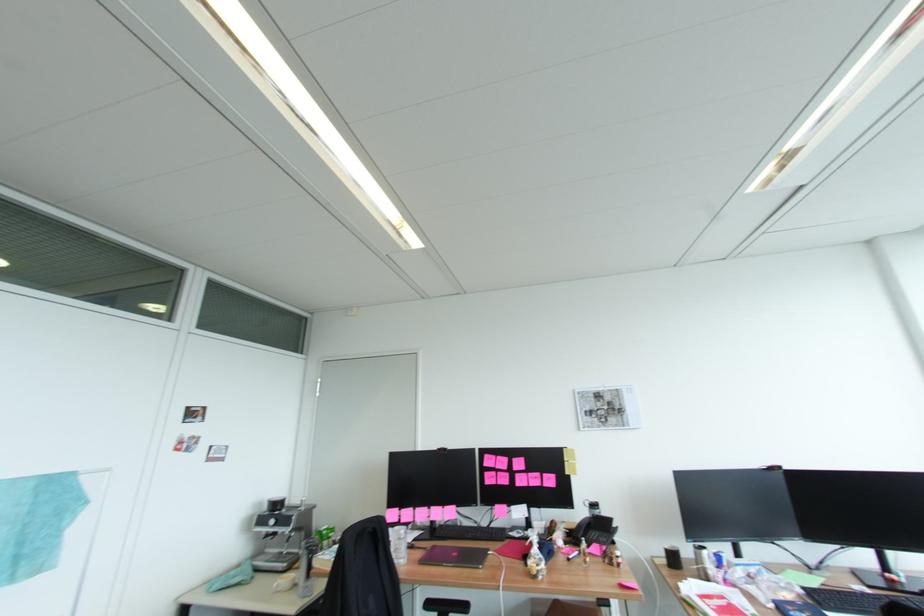
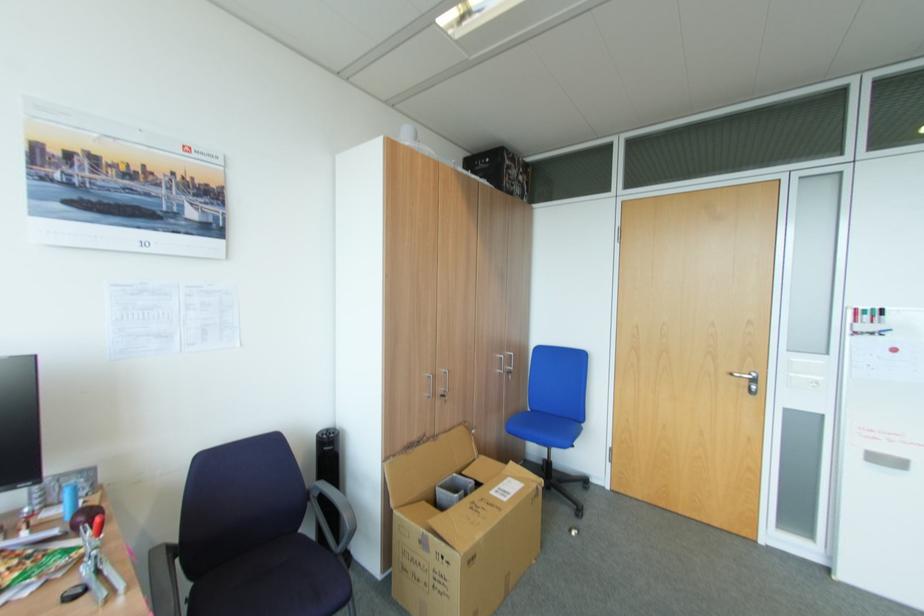
Question: Based on the continuous images, in which direction is the camera rotating? Reply with the corresponding letter.

Choices:
 (A) Left
 (B) Right
 (C) Up
 (D) Down

Answer: (A)